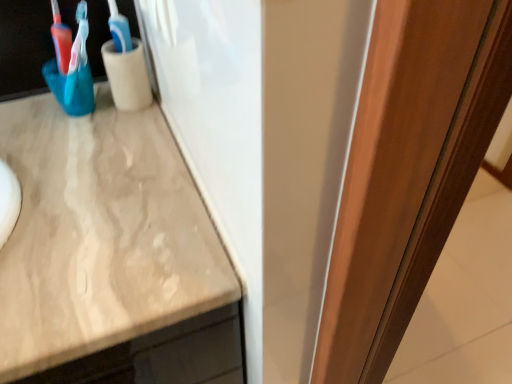
Question: From a real-world perspective, relative to blue plastic toothbrush at upper left, is smooth wooden door at right vertically above or below?

Choices:
 (A) above
 (B) below

Answer: (B)

Question: Is point (419, 281) closer or farther from the camera than point (117, 36)?

Choices:
 (A) closer
 (B) farther

Answer: (A)

Question: Considering the positions of smooth wooden door at right and blue plastic toothbrush at upper left in the image, is smooth wooden door at right bigger or smaller than blue plastic toothbrush at upper left?

Choices:
 (A) big
 (B) small

Answer: (A)

Question: From the image's perspective, relative to smooth wooden door at right, is blue plastic toothbrush at upper left above or below?

Choices:
 (A) above
 (B) below

Answer: (A)

Question: Is blue plastic toothbrush at upper left to the left or to the right of smooth wooden door at right in the image?

Choices:
 (A) left
 (B) right

Answer: (A)

Question: From a real-world perspective, is blue plastic toothbrush at upper left above or below smooth wooden door at right?

Choices:
 (A) above
 (B) below

Answer: (A)

Question: Based on their sizes in the image, would you say blue plastic toothbrush at upper left is bigger or smaller than smooth wooden door at right?

Choices:
 (A) small
 (B) big

Answer: (A)